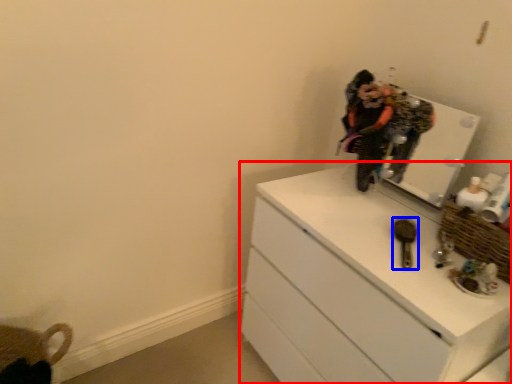
Question: Which object is further to the camera taking this photo, chest of drawers (highlighted by a red box) or brush (highlighted by a blue box)?

Choices:
 (A) chest of drawers
 (B) brush

Answer: (B)